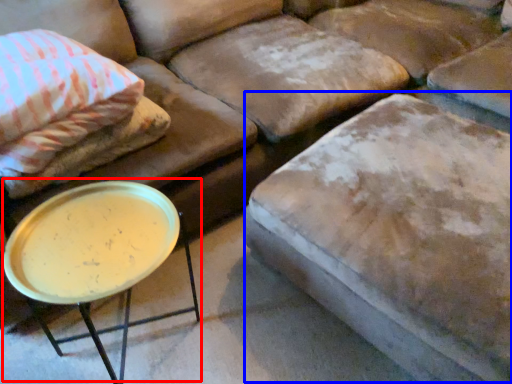
Question: Which object appears closest to the camera in this image, round table (highlighted by a red box) or swivel chair (highlighted by a blue box)?

Choices:
 (A) round table
 (B) swivel chair

Answer: (B)